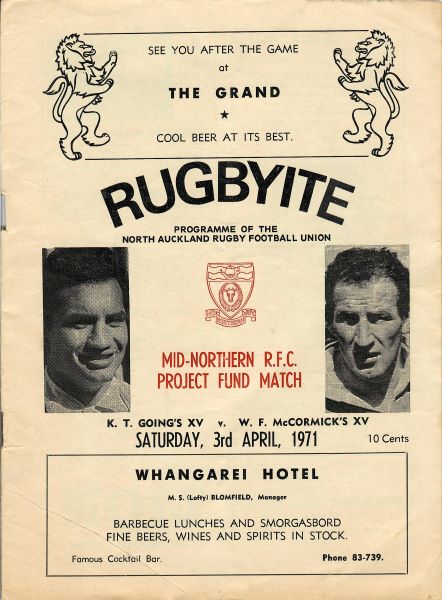
You are a GUI agent. You are given a task and a screenshot of the screen. Output one action in this format:
    pyautogui.click(x=<x>, y=<y>)
    Task: Click on the famous cocktail bar
    The width and height of the screenshot is (442, 600).
    Given the screenshot: What is the action you would take?
    pyautogui.click(x=114, y=557)